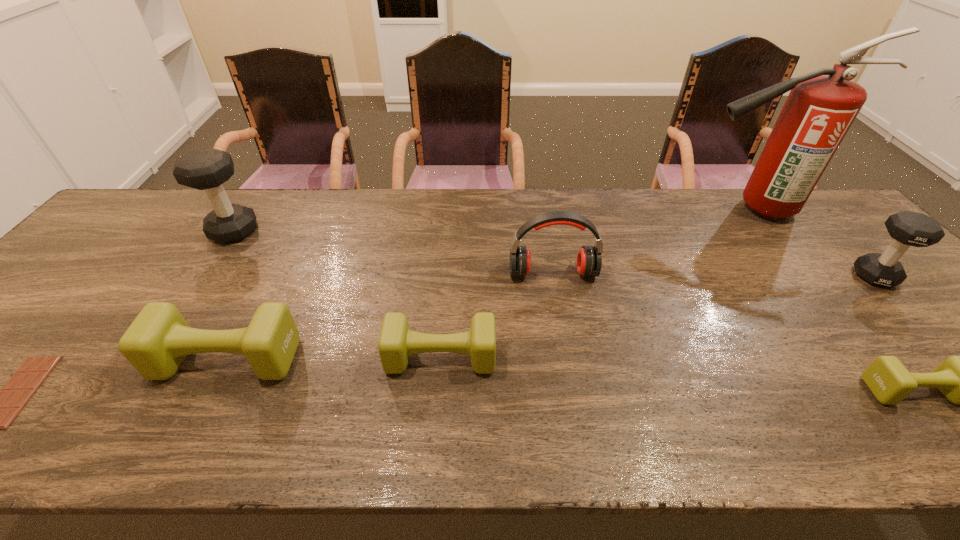
Find the location of a particular element. Image resolution: width=960 pixels, height=540 pixels. the second biggest olive dumbbell is located at coordinates (396, 343).

Where is `the second olive dumbbell from right to left`? This screenshot has height=540, width=960. the second olive dumbbell from right to left is located at coordinates (396, 343).

I want to click on vacant region located 0.340m at the nozzle of the fire extinguisher, so coord(581,210).

Locate an element on the screen. This screenshot has height=540, width=960. vacant space located 0.200m at the nozzle of the fire extinguisher is located at coordinates (625, 210).

I want to click on free space located at the nozzle of the fire extinguisher, so click(x=590, y=210).

Locate an element on the screen. vacant space located 0.400m on the right of the bigger gray dumbbell is located at coordinates (394, 231).

I want to click on free space located on the ear cups of the earphone, so click(x=572, y=387).

You are a GUI agent. You are given a task and a screenshot of the screen. Output one action in this format:
    pyautogui.click(x=<x>, y=<y>)
    Task: Click on the free spot located on the left of the right gray dumbbell
    
    Given the screenshot: What is the action you would take?
    pyautogui.click(x=824, y=276)

Locate an element on the screen. This screenshot has width=960, height=540. free space located on the left of the fifth tallest object is located at coordinates (30, 359).

Where is `vacant area situated on the right of the second olive dumbbell from right to left`? vacant area situated on the right of the second olive dumbbell from right to left is located at coordinates (544, 357).